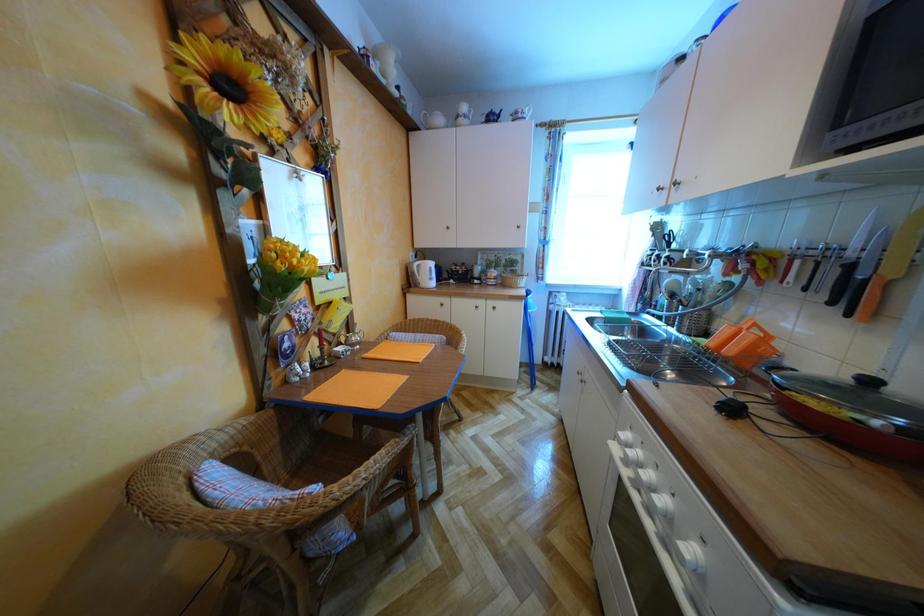
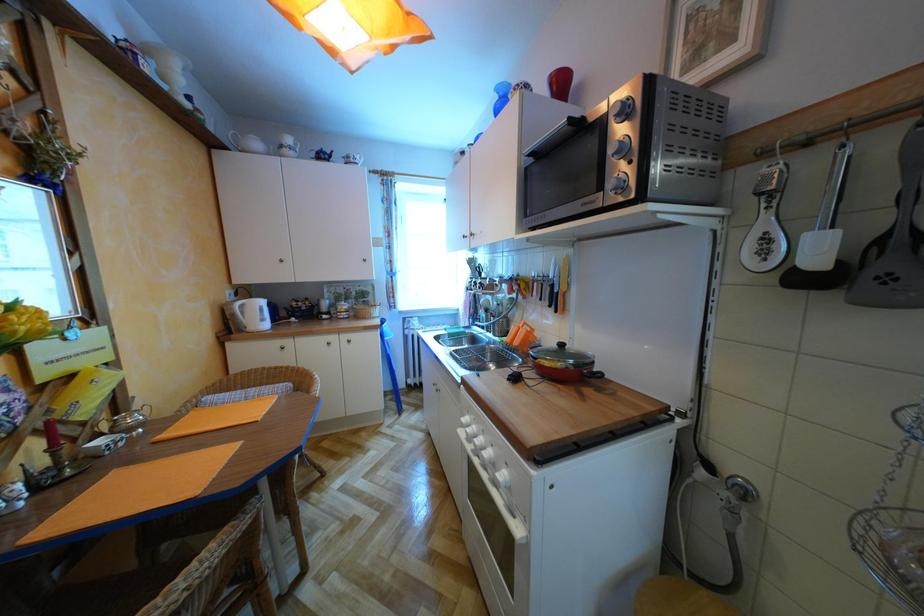
Question: Based on the continuous images, in which direction is the camera rotating? Reply with the corresponding letter.

Choices:
 (A) Left
 (B) Right
 (C) Up
 (D) Down

Answer: (B)